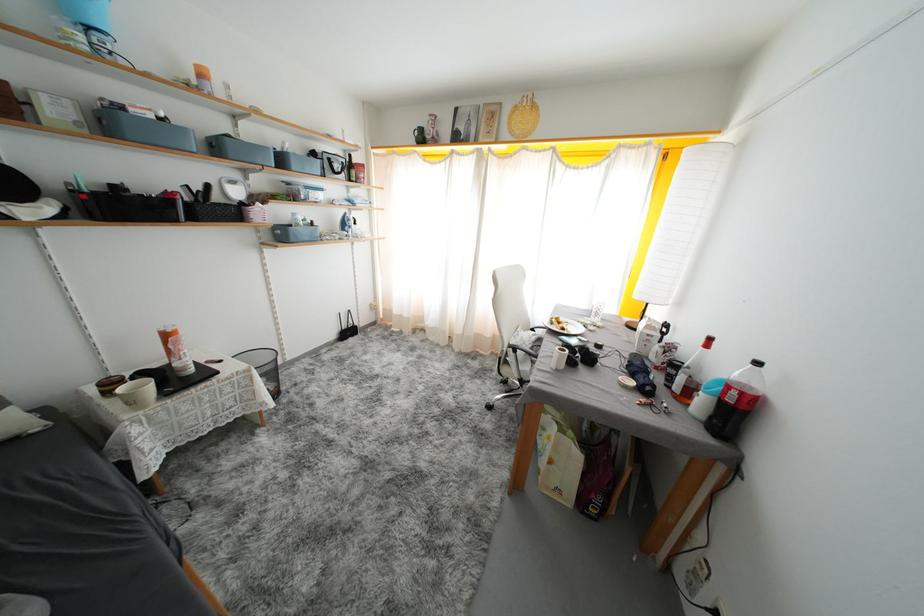
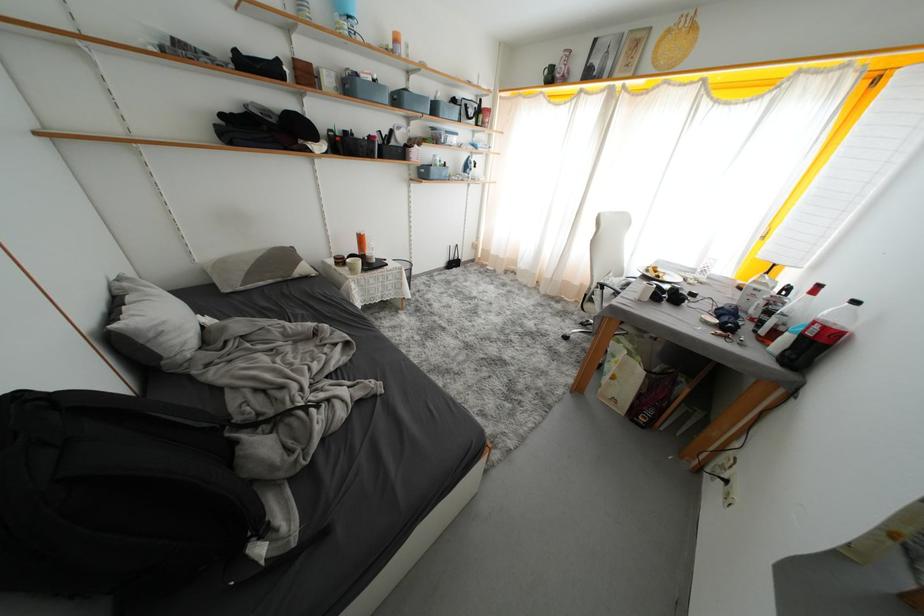
In the second image, find the point that corresponds to point 735,391 in the first image.

(821, 328)